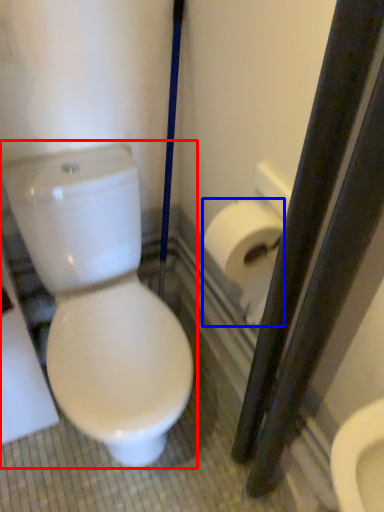
Question: Among these objects, which one is farthest to the camera, toilet (highlighted by a red box) or toilet paper (highlighted by a blue box)?

Choices:
 (A) toilet
 (B) toilet paper

Answer: (B)